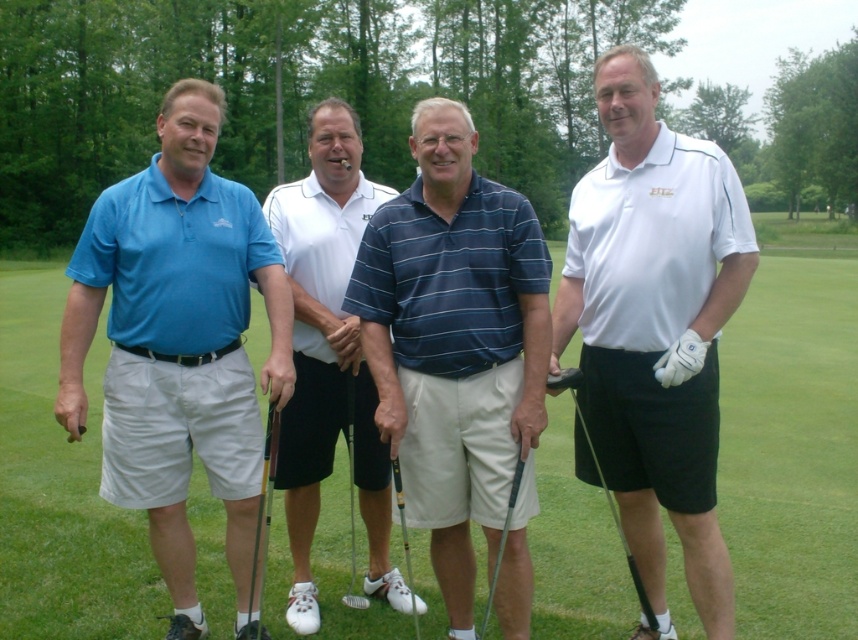
Between point (687, 422) and point (369, 392), which one is positioned in front?

Positioned in front is point (687, 422).

Who is higher up, white smooth golf shirt at center or white matte golf club at center?

white matte golf club at center is higher up.

This screenshot has height=640, width=858. Describe the element at coordinates (656, 326) in the screenshot. I see `white smooth golf shirt at center` at that location.

Find the location of `white smooth golf shirt at center`. white smooth golf shirt at center is located at coordinates (656, 326).

Does blue striped polo shirt at center have a lesser width compared to white matte golf club at center?

In fact, blue striped polo shirt at center might be wider than white matte golf club at center.

Is blue striped polo shirt at center further to camera compared to white matte golf club at center?

That is False.

Between point (527, 600) and point (372, 545), which one is positioned behind?

The point (372, 545) is more distant.

Where is `blue striped polo shirt at center`? Image resolution: width=858 pixels, height=640 pixels. blue striped polo shirt at center is located at coordinates (454, 340).

Does green grass at center have a lesser height compared to metallic shaft at lower left?

Incorrect, green grass at center's height does not fall short of metallic shaft at lower left's.

Describe the element at coordinates (792, 445) in the screenshot. I see `green grass at center` at that location.

I want to click on green grass at center, so click(x=792, y=445).